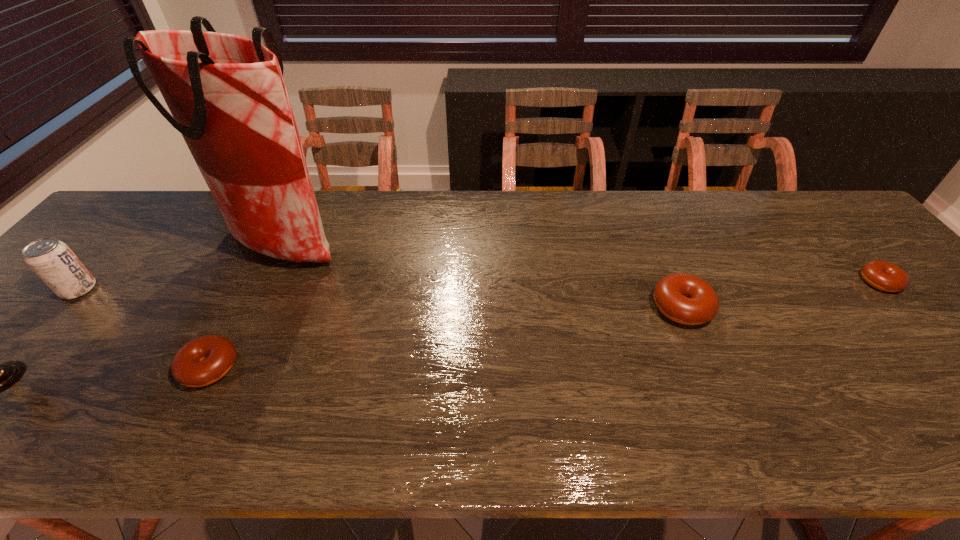
Identify the location of the second tallest doughnut. (204, 360).

At what (x,y) coordinates should I click in order to perform the action: click on the leftmost doughnut. Please return your answer as a coordinate pair (x, y). This screenshot has height=540, width=960. Looking at the image, I should click on 204,360.

At what (x,y) coordinates should I click in order to perform the action: click on the third shortest object. Please return your answer as a coordinate pair (x, y). Looking at the image, I should click on (687, 299).

This screenshot has height=540, width=960. I want to click on the fourth object from left to right, so click(687, 299).

The height and width of the screenshot is (540, 960). I want to click on the shortest doughnut, so [882, 275].

Find the location of a particular element. The image size is (960, 540). the rightmost doughnut is located at coordinates (882, 275).

The height and width of the screenshot is (540, 960). I want to click on the leftmost object, so click(x=53, y=261).

You are a GUI agent. You are given a task and a screenshot of the screen. Output one action in this format:
    pyautogui.click(x=<x>, y=<y>)
    Task: Click on the soda can
    
    Given the screenshot: What is the action you would take?
    tap(53, 261)

I want to click on the tallest object, so click(x=226, y=93).

At what (x,y) coordinates should I click in order to perform the action: click on vacant space located on the right of the second shortest doughnut. Please return your answer as a coordinate pair (x, y). This screenshot has height=540, width=960. Looking at the image, I should click on (367, 367).